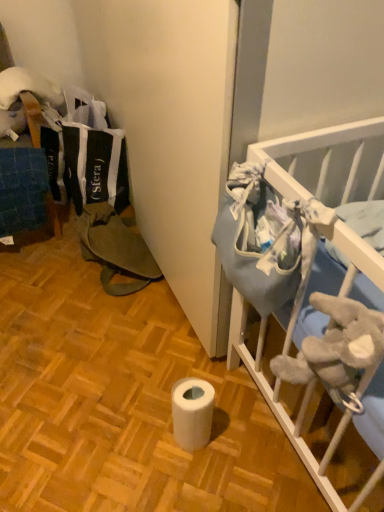
Locate an element on the screen. spots to the right of white matte toilet paper at center is located at coordinates (246, 443).